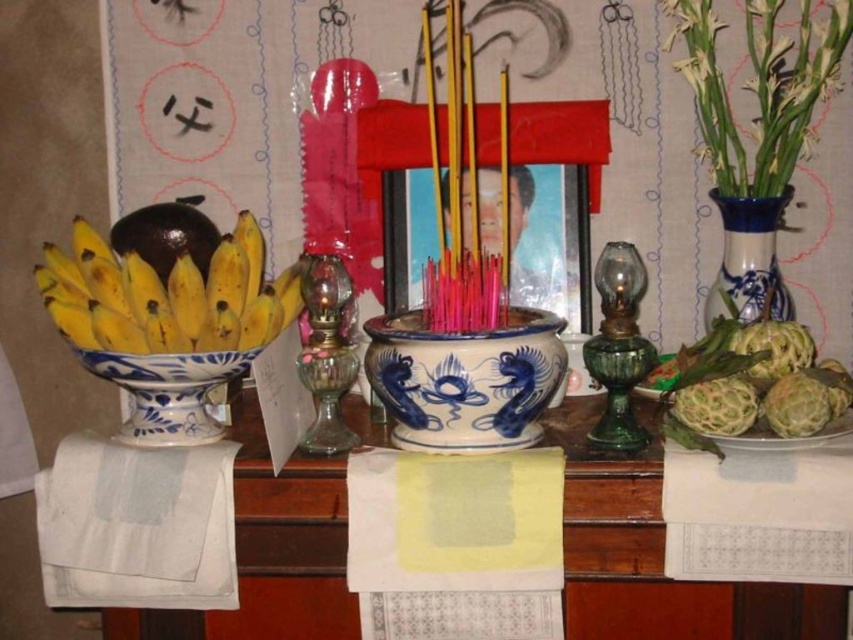
You are standing in front of the altar and want to place a new offering between the yellow matte bananas at left and the blue and white ceramic vase at right. Based on their positions, which object should you move closer to you to create space?

The yellow matte bananas at left are closer to the viewer than the blue and white ceramic vase at right. To create space between them, you should move the yellow matte bananas at left further away from you or the blue and white ceramic vase at right closer to you.

You are a priest preparing the altar and need to place a small candle between the white cotton cloth at lower left and the blue and white porcelain bowl at left. Is there enough space to place the candle between them?

The white cotton cloth at lower left is 7.06 centimeters away from the blue and white porcelain bowl at left. Since the candle requires at least 5 centimeters of space, there is enough space to place the candle between them.

In the scene shown: You are a visitor at the altar and want to place a new offering behind the yellow paper at center. Can you do this without moving the yellow matte bananas at left?

The yellow paper at center is in front of the yellow matte bananas at left, so you can place the new offering behind the yellow paper at center without moving the yellow matte bananas at left.